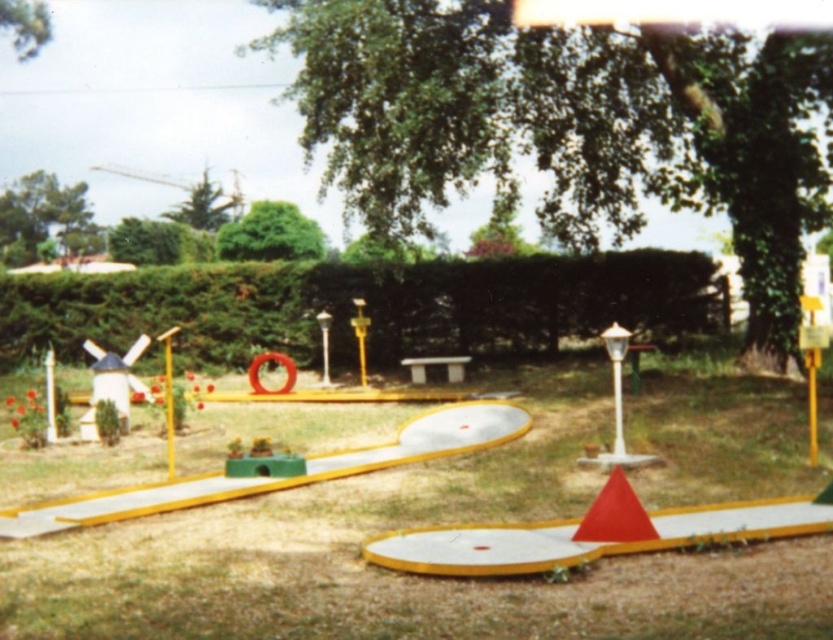
Can you confirm if yellow plastic pole at center is smaller than metallic pole at center?

Actually, yellow plastic pole at center might be larger than metallic pole at center.

Which is more to the right, yellow plastic pole at center or metallic pole at center?

metallic pole at center

Which is behind, point (166, 429) or point (614, 397)?

The point (614, 397) is more distant.

Locate an element on the screen. This screenshot has height=640, width=833. yellow plastic pole at center is located at coordinates (168, 400).

Is red matte cone at center smaller than metallic pole at center?

Yes.

Can you confirm if red matte cone at center is positioned to the left of metallic pole at center?

Correct, you'll find red matte cone at center to the left of metallic pole at center.

Does point (607, 529) come in front of point (619, 458)?

Yes.

At what (x,y) coordinates should I click in order to perform the action: click on red matte cone at center. Please return your answer as a coordinate pair (x, y). The image size is (833, 640). Looking at the image, I should click on (615, 515).

Is point (687, 292) positioned in front of point (615, 420)?

No, (687, 292) is behind (615, 420).

Does point (133, 292) come behind point (617, 429)?

That is True.

Between point (554, 300) and point (622, 451), which one is positioned behind?

Positioned behind is point (554, 300).

Locate an element on the screen. green leafy hedge at center is located at coordinates (367, 307).